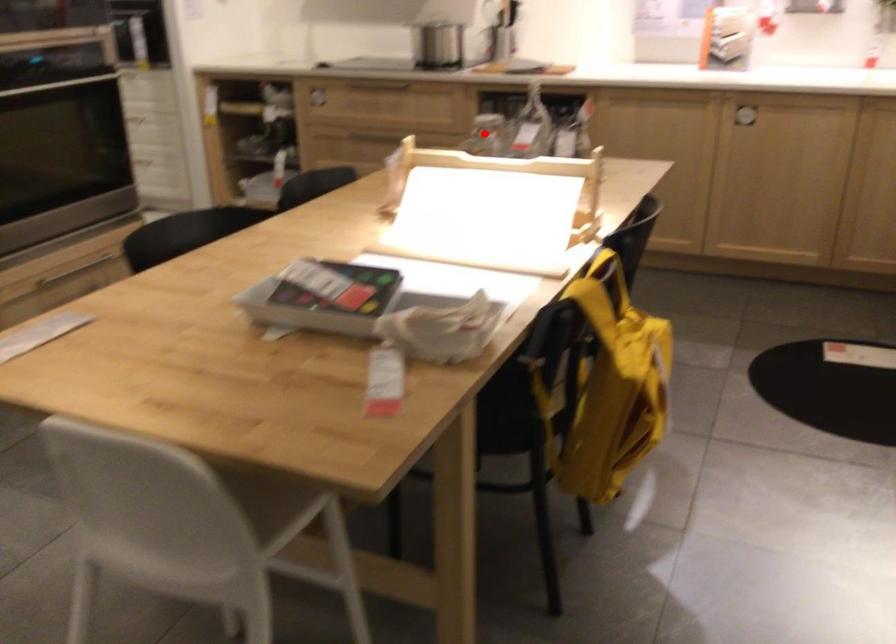
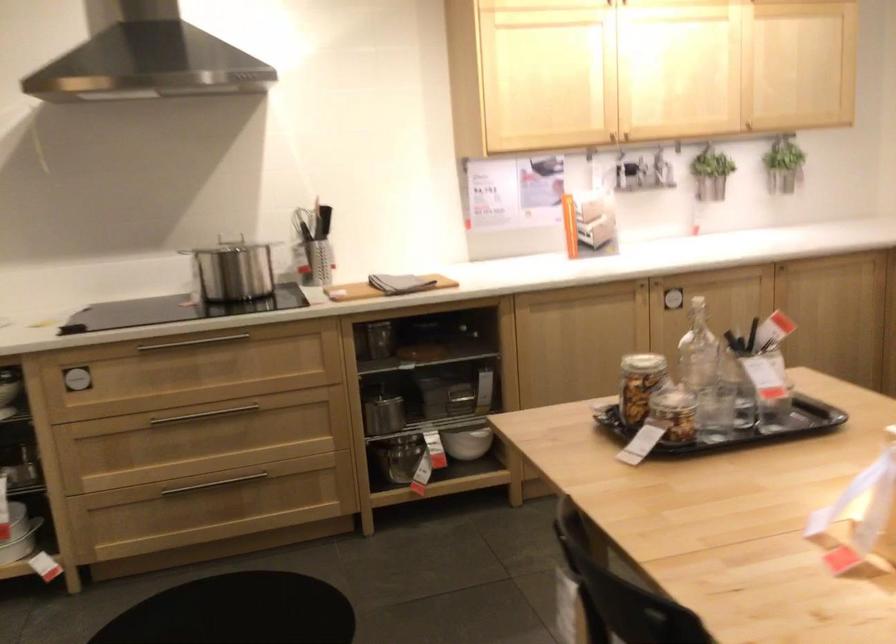
Question: I am providing you with two images of the same scene from different viewpoints. Given a red point in image1, look at the same physical point in image2. Is it:

Choices:
 (A) Closer to the viewpoint
 (B) Farther from the viewpoint

Answer: (A)